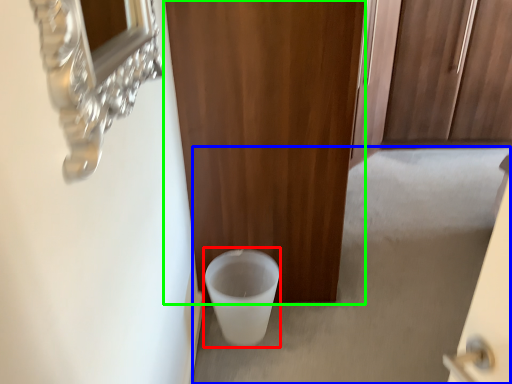
Question: Which object is positioned farthest from toilet bowl (highlighted by a red box)? Select from concrete (highlighted by a blue box) and door (highlighted by a green box).

Choices:
 (A) concrete
 (B) door

Answer: (A)